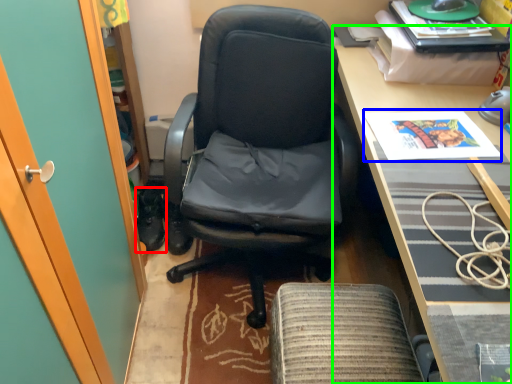
Question: Based on their relative distances, which object is nearer to footwear (highlighted by a red box)? Choose from magazine (highlighted by a blue box) and desk (highlighted by a green box).

Choices:
 (A) magazine
 (B) desk

Answer: (B)